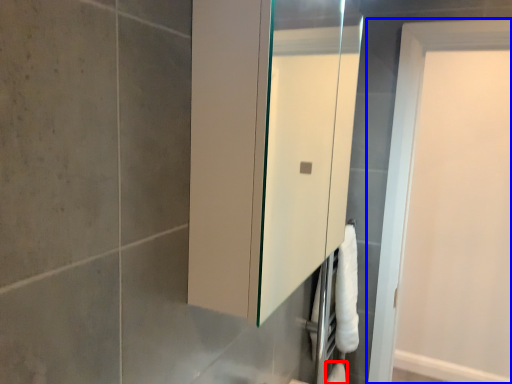
Question: Which point is further to the camera, toilet paper (highlighted by a red box) or door (highlighted by a blue box)?

Choices:
 (A) toilet paper
 (B) door

Answer: (A)